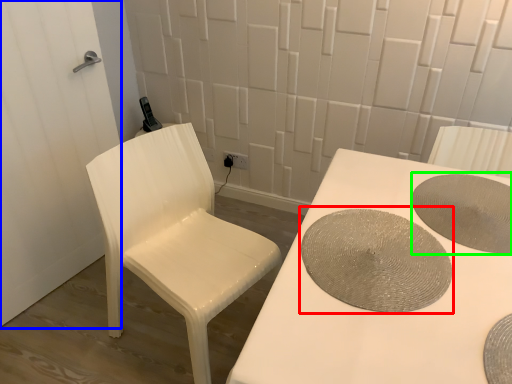
Question: Which object is the farthest from manhole cover (highlighted by a red box)? Choose among these: screen door (highlighted by a blue box) or manhole cover (highlighted by a green box).

Choices:
 (A) screen door
 (B) manhole cover

Answer: (A)